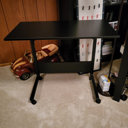
Find the location of a particular element. The image size is (128, 128). carpet is located at coordinates (71, 107).